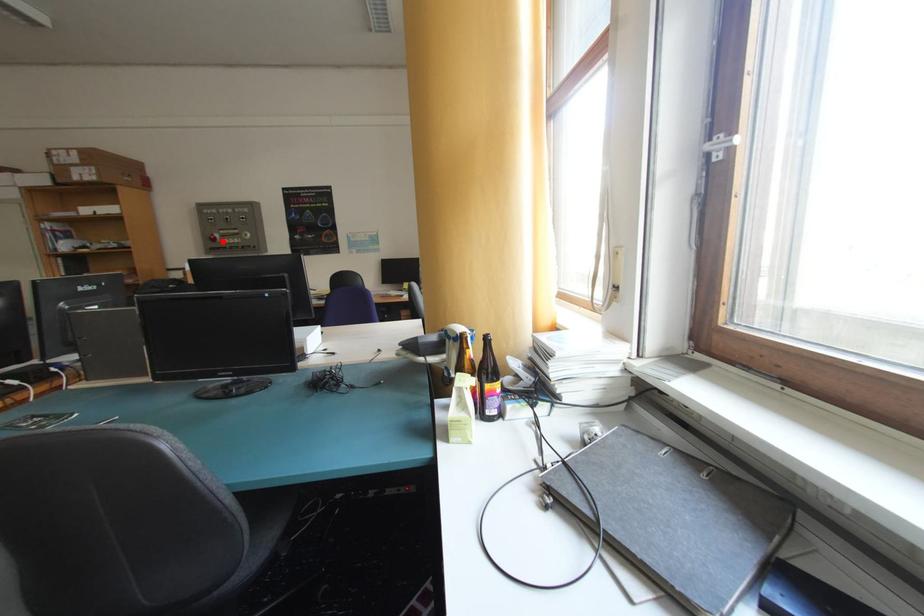
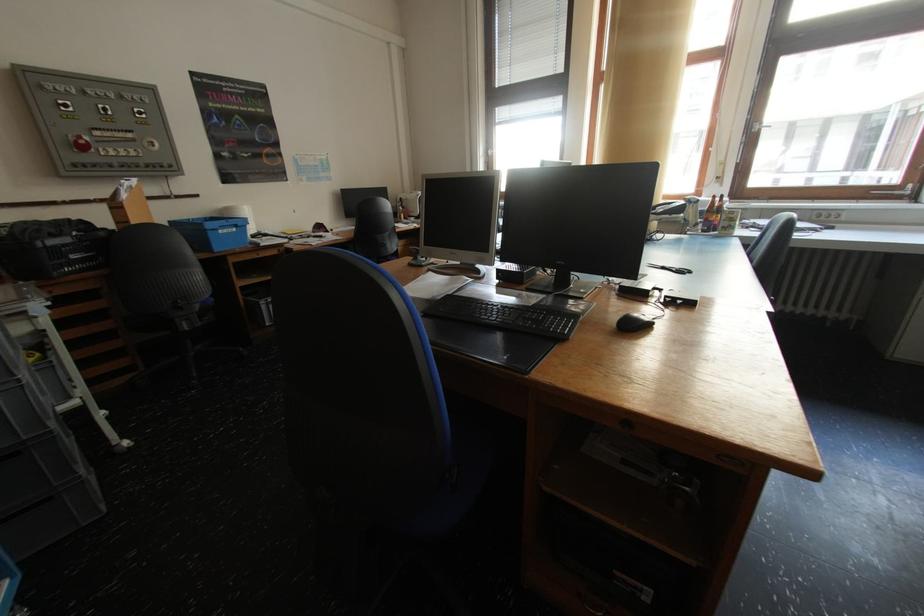
Question: A red point is marked in image1. In image2, is the corresponding 3D point closer to the camera or farther? Reply with the corresponding letter.

Choices:
 (A) The corresponding 3D point is closer.
 (B) The corresponding 3D point is farther.

Answer: (B)